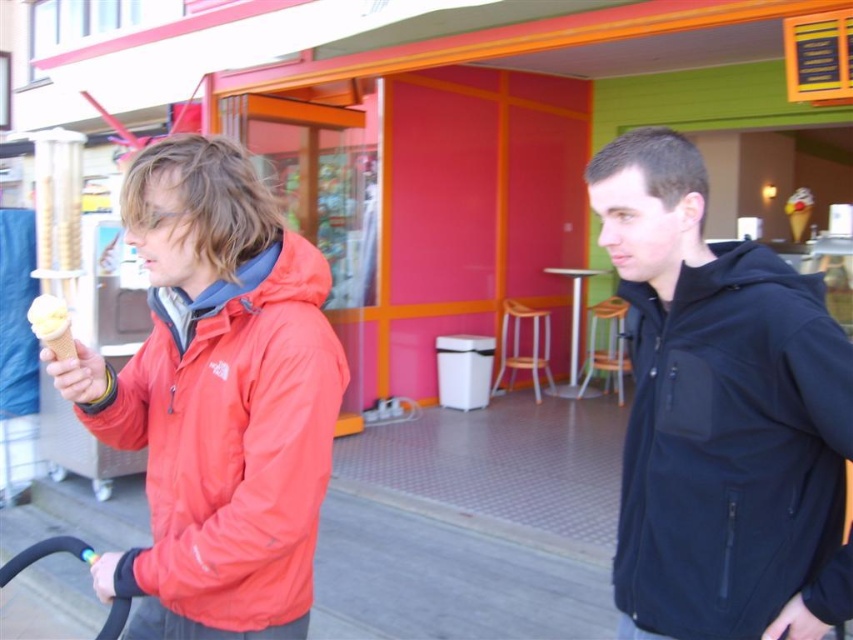
You are standing at the point with coordinates point [795,212] and want to walk to the entrance of the ice cream shop. The entrance is located at point [779,577]. Is the entrance in front of you or behind you?

The entrance at point [779,577] is in front of you because it is in front of point [795,212] where you are standing.

You are standing in front of the ice cream shop and see the matte red jacket at left and the vanilla ice cream in waffle cone at left. Which object is positioned more to the left side of the scene?

The vanilla ice cream in waffle cone at left is positioned more to the left side of the scene because the matte red jacket at left is to the right of it.

You are a photographer trying to capture a closeup of the vanilla ice cream in waffle cone at left while ensuring the matte red jacket at left remains visible in the frame. Given their size difference, which object should you focus on to include both in the photo?

The matte red jacket at left is larger than the vanilla ice cream in waffle cone at left, so focusing on the matte red jacket at left would allow both objects to be visible in the frame while maintaining the ice cream cone in view.